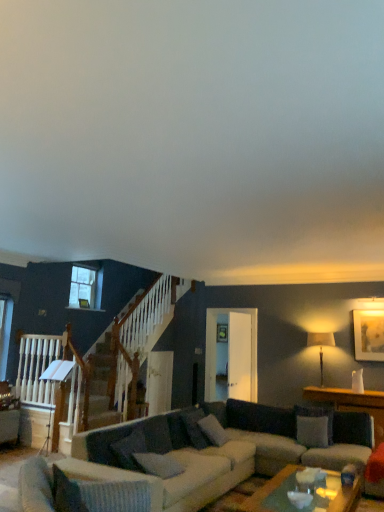
Measure the distance between point (x=110, y=488) and camera.

The depth of point (x=110, y=488) is 8.78 feet.

Locate an element on the screen. matte gold picture frame at upper right is located at coordinates (369, 335).

This screenshot has height=512, width=384. Describe the element at coordinates (85, 288) in the screenshot. I see `clear glass window at upper left` at that location.

This screenshot has width=384, height=512. What do you see at coordinates (239, 356) in the screenshot?
I see `white glossy door at center` at bounding box center [239, 356].

Locate an element on the screen. white glossy door at center is located at coordinates (239, 356).

In order to click on wooden table at right in this screenshot , I will do `click(352, 404)`.

Would you say wooden table at right is outside gray fabric pillow at center, which is the second pillow from left to right?

Yes.

Can you see wooden table at right touching gray fabric pillow at center, the 3th pillow from the back?

No, wooden table at right is not next to gray fabric pillow at center, the 3th pillow from the back.

Between wooden table at right and gray fabric pillow at center, the 3th pillow from the back, which one appears on the right side from the viewer's perspective?

Positioned to the right is wooden table at right.

From the image's perspective, who appears lower, wooden table at right or gray fabric pillow at center, which is the second pillow from left to right?

wooden table at right appears lower in the image.

Which object is positioned more to the right, gray fabric pillow at center, the 2th pillow from the back, or white fabric pillow at center, which ranks as the 4th pillow in left-to-right order?

white fabric pillow at center, which ranks as the 4th pillow in left-to-right order.

Is gray fabric pillow at center, the 2th pillow from the back, positioned with its back to white fabric pillow at center, which is the 1th pillow in back-to-front order?

No, gray fabric pillow at center, the 2th pillow from the back, is not facing away from white fabric pillow at center, which is the 1th pillow in back-to-front order.

From a real-world perspective, is gray fabric pillow at center, arranged as the third pillow when viewed from the front, physically above white fabric pillow at center, which ranks as the 4th pillow in left-to-right order?

Yes, from a real-world perspective, gray fabric pillow at center, arranged as the third pillow when viewed from the front, is above white fabric pillow at center, which ranks as the 4th pillow in left-to-right order.

Does gray fabric pillow at center, which is the second pillow from left to right, have a lesser width compared to wooden table at right?

Indeed, gray fabric pillow at center, which is the second pillow from left to right, has a lesser width compared to wooden table at right.

Is gray fabric pillow at center, the 3th pillow viewed from the right, not near wooden table at right?

That's right, there is a large distance between gray fabric pillow at center, the 3th pillow viewed from the right, and wooden table at right.

The width and height of the screenshot is (384, 512). Find the location of `the 3rd pillow positioned above the wooden table at right (from the image's perspective)`. the 3rd pillow positioned above the wooden table at right (from the image's perspective) is located at coordinates (157, 464).

From the image's perspective, would you say gray fabric pillow at center, which is the second pillow from left to right, is positioned over wooden table at right?

Yes.

In the scene shown: Is gray fabric pillow at center, which is counted as the 2th pillow, starting from the front, facing towards matte gold picture frame at upper right?

No.

Locate an element on the screen. This screenshot has width=384, height=512. picture frame above the gray fabric pillow at center, the 3th pillow from the back (from a real-world perspective) is located at coordinates (369, 335).

Is gray fabric pillow at center, which is the second pillow from left to right, with matte gold picture frame at upper right?

No, gray fabric pillow at center, which is the second pillow from left to right, is not making contact with matte gold picture frame at upper right.

Measure the distance from gray fabric pillow at center, the 3th pillow viewed from the right, to matte gold picture frame at upper right.

10.45 feet.

Is gray fabric pillow at center, the 2th pillow from the back, directly adjacent to textured gray couch at center?

gray fabric pillow at center, the 2th pillow from the back, and textured gray couch at center are clearly separated.

Considering the sizes of objects gray fabric pillow at center, which is the third pillow from left to right, and textured gray couch at center in the image provided, who is wider, gray fabric pillow at center, which is the third pillow from left to right, or textured gray couch at center?

With larger width is textured gray couch at center.

Between gray fabric pillow at center, the 2th pillow from the back, and textured gray couch at center, which one has more height?

textured gray couch at center is taller.

From a real-world perspective, is gray fabric pillow at center, arranged as the third pillow when viewed from the front, positioned under textured gray couch at center based on gravity?

No, from a real-world perspective, gray fabric pillow at center, arranged as the third pillow when viewed from the front, is not below textured gray couch at center.

Which object is positioned more to the right, white textured pillow at lower left, which is the 1th pillow in front-to-back order, or matte beige lampshade at right?

From the viewer's perspective, matte beige lampshade at right appears more on the right side.

Does white textured pillow at lower left, which is the 1th pillow in front-to-back order, contain matte beige lampshade at right?

No.

Consider the image. In terms of height, does white textured pillow at lower left, which is the 1th pillow in front-to-back order, look taller or shorter compared to matte beige lampshade at right?

Clearly, white textured pillow at lower left, which is the 1th pillow in front-to-back order, is shorter compared to matte beige lampshade at right.

Is matte beige lampshade at right at the right side of white glossy door at center?

Yes.

Is point (319, 341) positioned behind point (234, 384)?

No, it is not.

From the image's perspective, does matte beige lampshade at right appear lower than white glossy door at center?

No.

Find the location of a particular element. This screenshot has width=384, height=512. the 1st pillow above the wooden table at right (from a real-world perspective) is located at coordinates (157, 464).

This screenshot has height=512, width=384. Find the location of `the 1st pillow below the gray fabric pillow at center, the 2th pillow from the back (from a real-world perspective)`. the 1st pillow below the gray fabric pillow at center, the 2th pillow from the back (from a real-world perspective) is located at coordinates (312, 430).

Looking at the image, which one is located closer to matte gold picture frame at upper right, wooden table at right or gray fabric pillow at center, the 2th pillow viewed from the right?

wooden table at right.

Which object lies further to the anchor point matte beige lampshade at right, white glossy door at center or white fabric pillow at center, which ranks as the 4th pillow in left-to-right order?

Based on the image, white glossy door at center appears to be further to matte beige lampshade at right.

When comparing their distances from matte beige lampshade at right, does white fabric pillow at center, which is the 1th pillow in back-to-front order, or textured gray couch at center seem closer?

white fabric pillow at center, which is the 1th pillow in back-to-front order, is positioned closer to the anchor matte beige lampshade at right.

From the image, which object appears to be nearer to clear glass window at upper left, matte gold picture frame at upper right or matte beige lampshade at right?

matte beige lampshade at right.

Looking at the image, which one is located further to white fabric pillow at center, which is the 1th pillow in back-to-front order, textured gray couch at center or wooden table at right?

Among the two, textured gray couch at center is located further to white fabric pillow at center, which is the 1th pillow in back-to-front order.

Based on their spatial positions, is textured gray couch at center or matte gold picture frame at upper right further from gray fabric pillow at center, the 2th pillow viewed from the right?

Based on the image, matte gold picture frame at upper right appears to be further to gray fabric pillow at center, the 2th pillow viewed from the right.

Based on their spatial positions, is white glossy door at center or clear glass window at upper left closer to white fabric pillow at center, which ranks as the 4th pillow in left-to-right order?

Based on the image, white glossy door at center appears to be nearer to white fabric pillow at center, which ranks as the 4th pillow in left-to-right order.

From the picture: Based on their spatial positions, is wooden table at right or matte gold picture frame at upper right further from gray fabric pillow at center, the 2th pillow from the back?

matte gold picture frame at upper right is further to gray fabric pillow at center, the 2th pillow from the back.

In order to click on lamp between matte gold picture frame at upper right and wooden table at right in the up-down direction in this screenshot , I will do `click(320, 346)`.

Find the location of a particular element. This screenshot has width=384, height=512. lamp between gray fabric pillow at center, the 3th pillow from the back, and clear glass window at upper left, along the z-axis is located at coordinates (320, 346).

At what (x,y) coordinates should I click in order to perform the action: click on lamp between clear glass window at upper left and wooden table at right in the horizontal direction. Please return your answer as a coordinate pair (x, y). The height and width of the screenshot is (512, 384). Looking at the image, I should click on (320, 346).

Identify the location of pillow positioned between white textured pillow at lower left, acting as the 4th pillow starting from the back, and gray fabric pillow at center, arranged as the third pillow when viewed from the front, from near to far. This screenshot has width=384, height=512. (157, 464).